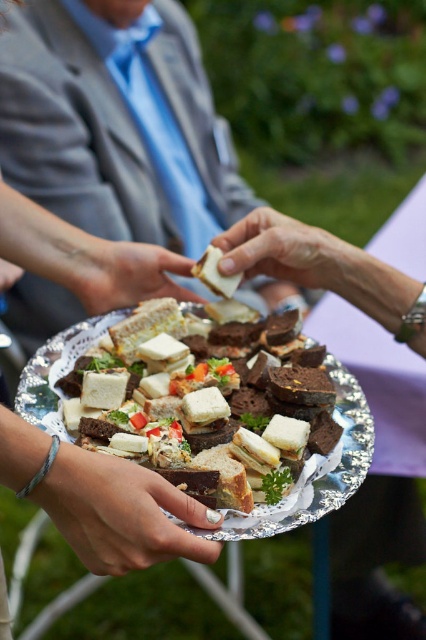
Question: Can you confirm if sliced bread at center is positioned below white matte sandwich at center?

Choices:
 (A) yes
 (B) no

Answer: (A)

Question: Which of the following is the farthest from the observer?

Choices:
 (A) satin silver tray at lower center
 (B) smooth skin hand at center
 (C) sliced bread at center

Answer: (B)

Question: Which point is farther to the camera?

Choices:
 (A) (164, 253)
 (B) (333, 241)

Answer: (A)

Question: Which of the following is the farthest from the observer?

Choices:
 (A) white matte sandwich at center
 (B) smooth skin hand at center

Answer: (B)

Question: Observing the image, what is the correct spatial positioning of sliced bread at center in reference to white matte sandwich at center?

Choices:
 (A) above
 (B) below

Answer: (B)

Question: Does sliced bread at center have a larger size compared to white matte sandwich at center?

Choices:
 (A) no
 (B) yes

Answer: (B)